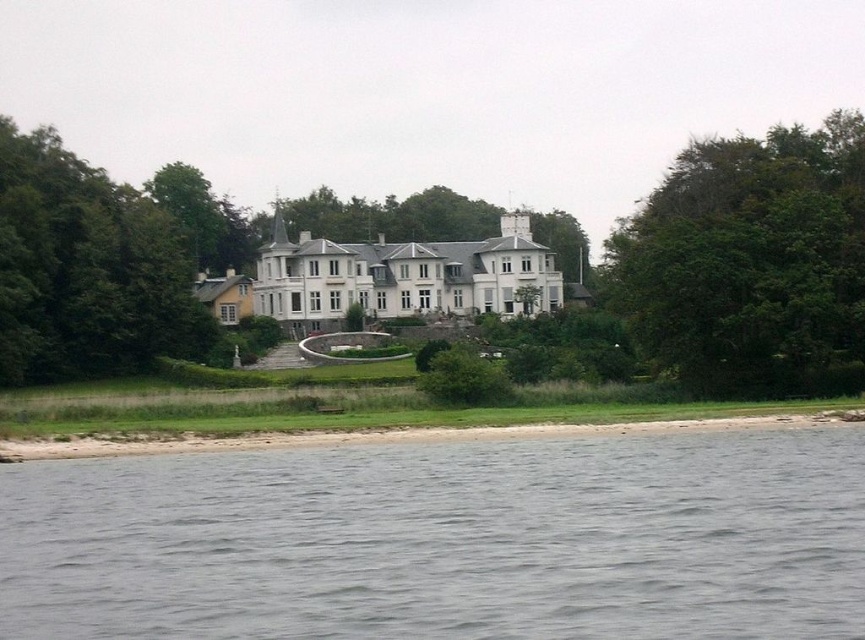
You are a photographer planning to capture the entire lakeside scene from your current position. Given that your camera can only focus on one of the two areas, the gray water at lower left or the smooth sand shoreline at lower center, which area should you choose to ensure the most detailed image? Please base your decision on their sizes as seen in the image.

The gray water at lower left is larger in size than the smooth sand shoreline at lower center, so choosing the gray water at lower left would allow for a more detailed image since it occupies a bigger portion of the frame.

You are planning a picnic and want to set up your blanket near the gray water at lower left while keeping an eye on your child playing near the green leafy tree at left. Can you do this without having to move more than 50 meters between the two locations?

The gray water at lower left and green leafy tree at left are 51.99 meters apart from each other. Since the distance exceeds 50 meters, you cannot stay within the desired range without moving.